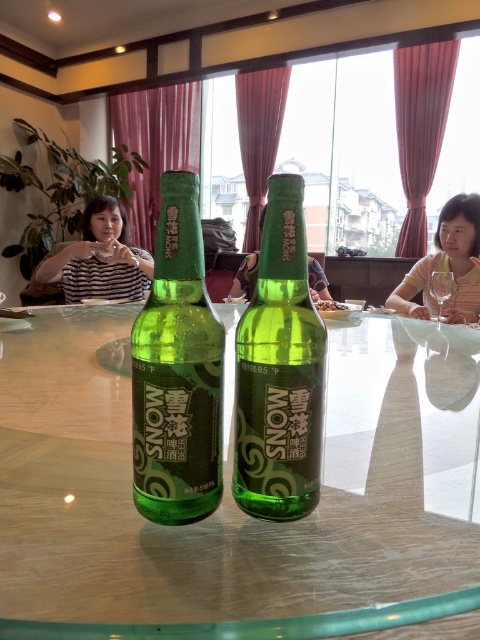
Which is above, striped fabric shirt at right or transparent glass wine glass at center?

striped fabric shirt at right is above.

Is point (451, 202) farther from viewer compared to point (447, 291)?

Yes, point (451, 202) is farther from viewer.

Is point (446, 228) closer to viewer compared to point (432, 276)?

No, (446, 228) is further to viewer.

The image size is (480, 640). I want to click on striped fabric shirt at right, so click(x=446, y=266).

From the picture: Does green glass bottle at center come behind striped fabric shirt at right?

No, it is not.

Does green glass bottle at center have a larger size compared to striped fabric shirt at right?

No, green glass bottle at center is not bigger than striped fabric shirt at right.

What do you see at coordinates (279, 371) in the screenshot?
I see `green glass bottle at center` at bounding box center [279, 371].

The image size is (480, 640). Find the location of `green glass bottle at center`. green glass bottle at center is located at coordinates (279, 371).

In the scene shown: Does green glass bottle at center appear over transparent glass wine glass at center?

No.

Who is positioned more to the right, green glass bottle at center or transparent glass wine glass at center?

From the viewer's perspective, transparent glass wine glass at center appears more on the right side.

This screenshot has width=480, height=640. Find the location of `green glass bottle at center`. green glass bottle at center is located at coordinates (279, 371).

This screenshot has width=480, height=640. Find the location of `green glass bottle at center`. green glass bottle at center is located at coordinates (279, 371).